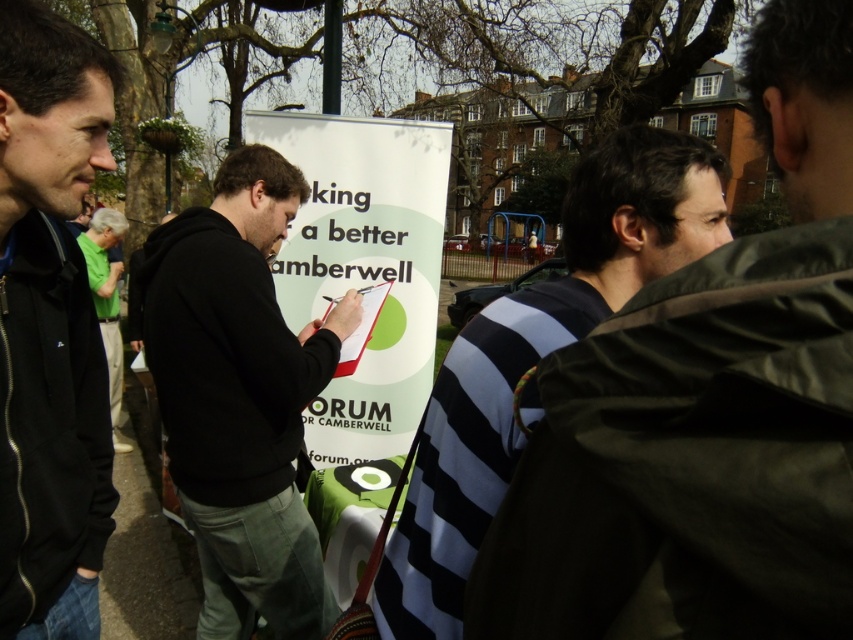
You are standing in a park and see a white paper signboard at center. There is a point marked at coordinates [364,264]. Where exactly is this point located on the signboard?

The point marked at coordinates [364,264] is located on the white paper signboard at center.

You are standing in the park and see the dark blue jacket at left. If you walk straight ahead, will you reach the signboard before the playground?

The dark blue jacket at left is located at point (50, 326), which is closer to the signboard than the playground. Therefore, walking straight ahead, you will reach the signboard before the playground.